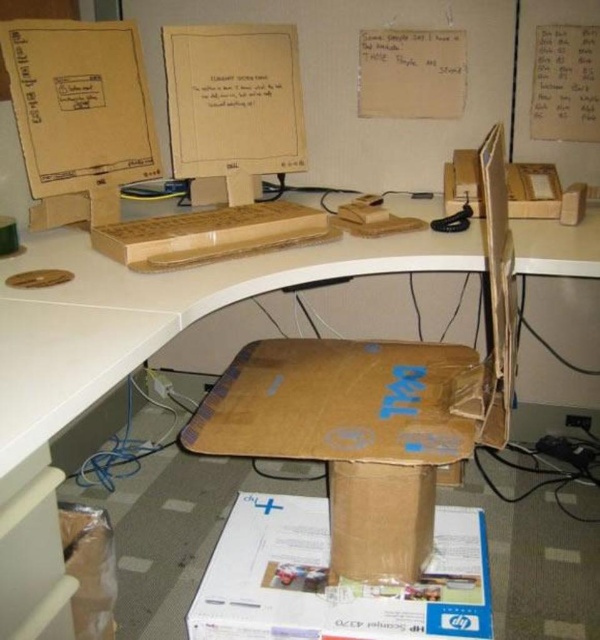
You are setting up a temporary workstation and need to place the brown cardboard computer desk at center and the matte cardboard computer at upper center. According to the image, which object should be positioned to the left side of the other?

The brown cardboard computer desk at center is to the right of the matte cardboard computer at upper center, so the matte cardboard computer at upper center should be placed to the left of the brown cardboard computer desk at center.

You are setting up a temporary office in a small room and need to place the brown cardboard computer desk at center and the brown cardboard box at center. According to the image, which object should be placed to the left of the other?

The brown cardboard computer desk at center is positioned on the left side of brown cardboard box at center, so the desk should be placed to the left of the box.

You are setting up a temporary workstation and need to place a small potted plant on the surface that can support it. Given the height difference between the brown cardboard computer desk at center and the brown cardboard box at center, which surface would be more stable for placing the plant?

The brown cardboard computer desk at center has a greater height compared to the brown cardboard box at center. Since the desk is taller and likely sturdier, it would provide a more stable surface for placing the small potted plant.